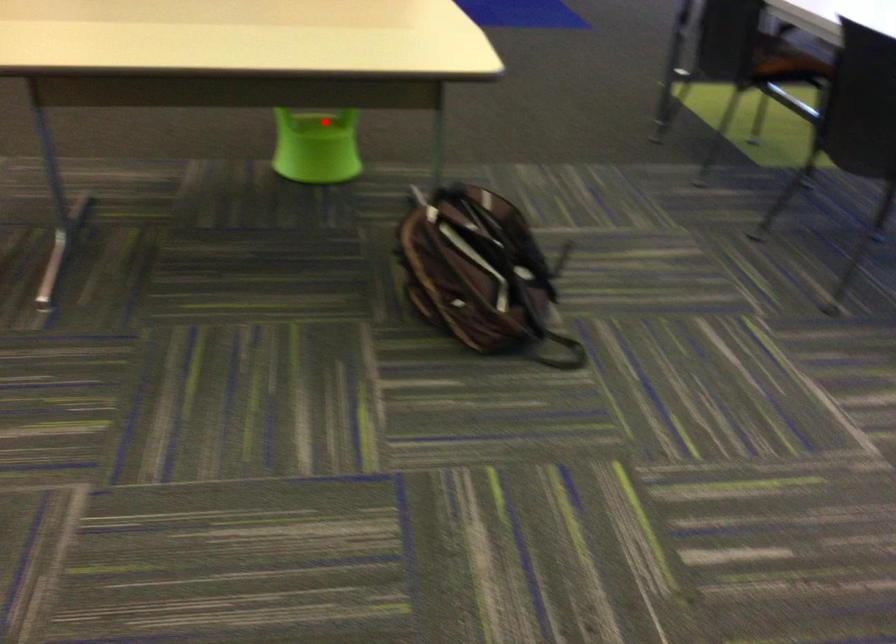
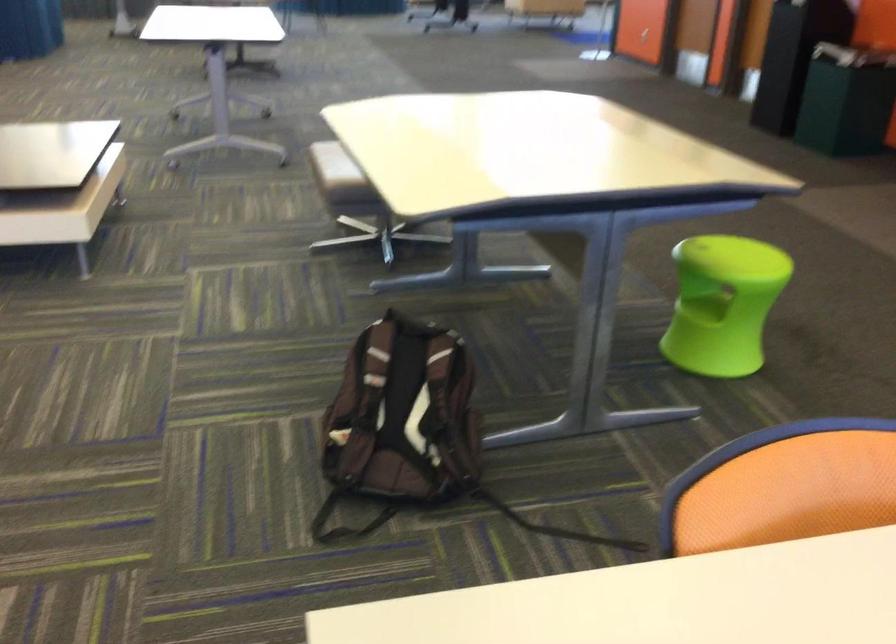
In the second image, find the point that corresponds to the highlighted location in the first image.

(702, 307)